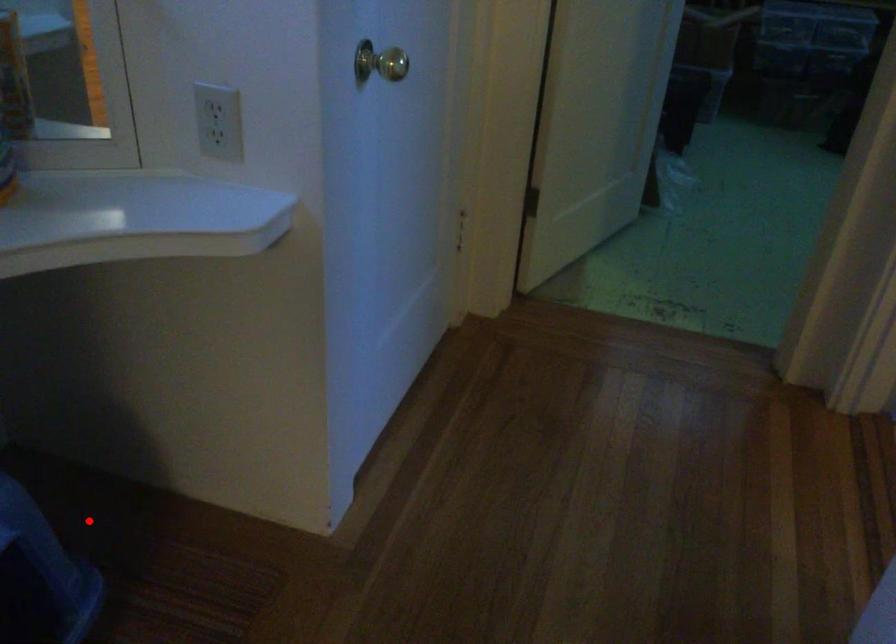
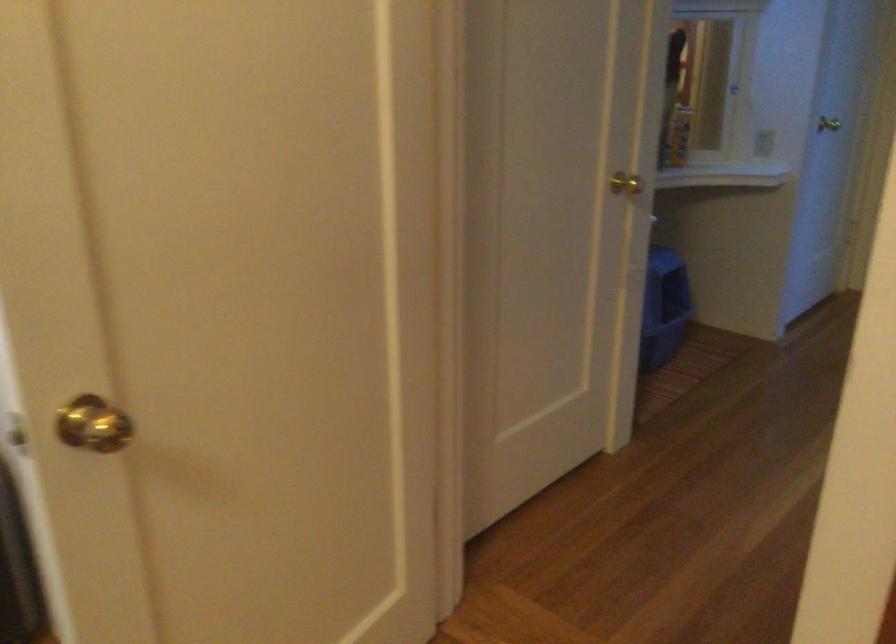
The point at the highlighted location is marked in the first image. Where is the corresponding point in the second image?

(664, 308)